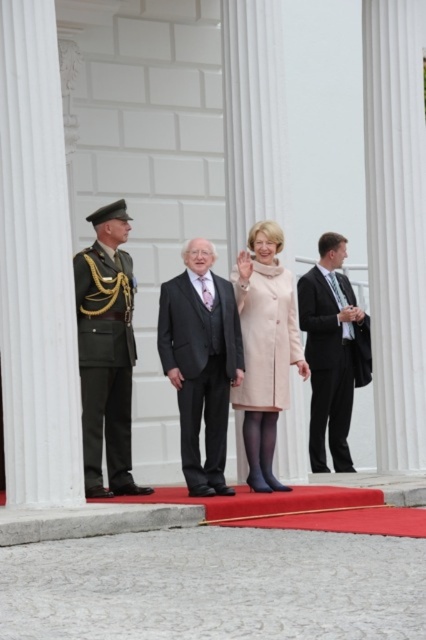
Question: Which object is the farthest from the green military uniform at left?

Choices:
 (A) pale pink wool coat at center
 (B) black suit at right
 (C) dark gray suit at center

Answer: (B)

Question: Which object appears farthest from the camera in this image?

Choices:
 (A) black suit at right
 (B) dark gray suit at center
 (C) pale pink wool coat at center
 (D) green military uniform at left

Answer: (A)

Question: Can you confirm if green military uniform at left is positioned above pale pink wool coat at center?

Choices:
 (A) yes
 (B) no

Answer: (A)

Question: Estimate the real-world distances between objects in this image. Which object is closer to the dark gray suit at center?

Choices:
 (A) black suit at right
 (B) pale pink wool coat at center
 (C) green military uniform at left

Answer: (B)

Question: Can you confirm if pale pink wool coat at center is positioned to the right of black suit at right?

Choices:
 (A) no
 (B) yes

Answer: (A)

Question: Is green military uniform at left thinner than black suit at right?

Choices:
 (A) no
 (B) yes

Answer: (B)